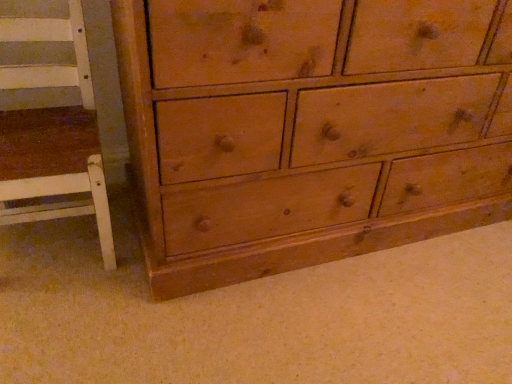
Identify the location of vacant space to the right of white wood armchair at left. (136, 273).